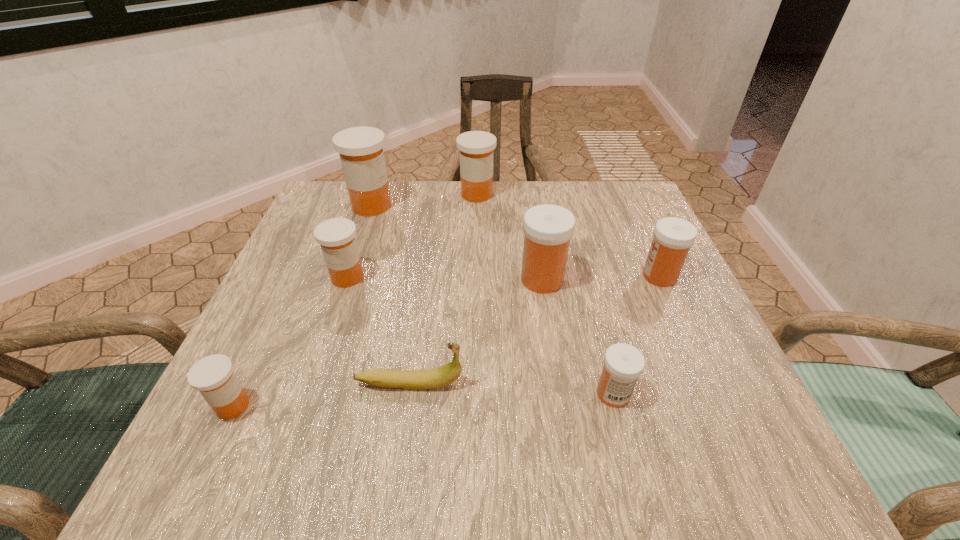
This screenshot has width=960, height=540. In order to click on the biggest orange medicine in this screenshot , I will do `click(361, 153)`.

At what (x,y) coordinates should I click in order to perform the action: click on the tallest object. Please return your answer as a coordinate pair (x, y). The width and height of the screenshot is (960, 540). Looking at the image, I should click on (361, 153).

Identify the location of the rightmost orange medicine. (476, 148).

Find the location of a particular element. the fourth medicine from left to right is located at coordinates (476, 148).

Locate an element on the screen. The width and height of the screenshot is (960, 540). the biggest white medicine is located at coordinates (548, 228).

This screenshot has width=960, height=540. Identify the location of the fifth medicine from left to right. (548, 228).

The height and width of the screenshot is (540, 960). Find the location of `the third biggest orange medicine`. the third biggest orange medicine is located at coordinates (336, 236).

Locate an element on the screen. the rightmost medicine is located at coordinates (673, 237).

At what (x,y) coordinates should I click in order to perform the action: click on the rightmost white medicine. Please return your answer as a coordinate pair (x, y). Looking at the image, I should click on (673, 237).

This screenshot has width=960, height=540. I want to click on banana, so click(x=438, y=377).